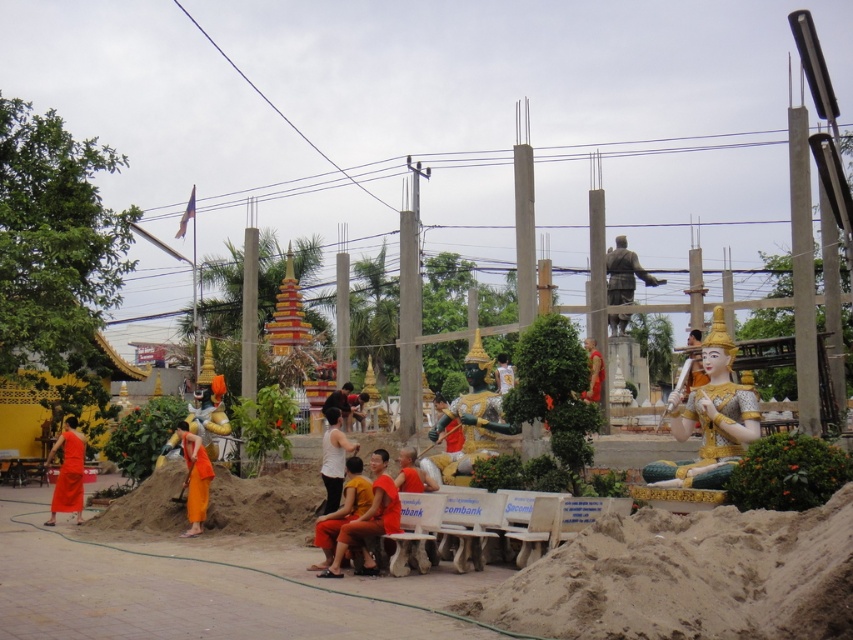
Consider the image. You are a photographer trying to capture both the orange clothed person at center and the matte orange robe at left in a single frame. Based on their heights, which one would you need to position closer to the camera to ensure both are fully visible?

The orange clothed person at center is shorter than the matte orange robe at left, so you should position the matte orange robe at left closer to the camera to ensure both are fully visible.